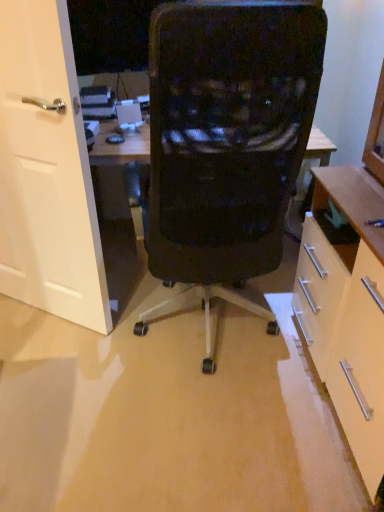
Question: Is white matte door at left wider than black mesh chair at center?

Choices:
 (A) no
 (B) yes

Answer: (A)

Question: Does white matte door at left come behind black mesh chair at center?

Choices:
 (A) yes
 (B) no

Answer: (A)

Question: Is white matte door at left not close to black mesh chair at center?

Choices:
 (A) yes
 (B) no

Answer: (B)

Question: Is white matte door at left positioned with its back to black mesh chair at center?

Choices:
 (A) yes
 (B) no

Answer: (B)

Question: Considering the relative sizes of white matte door at left and black mesh chair at center in the image provided, is white matte door at left thinner than black mesh chair at center?

Choices:
 (A) yes
 (B) no

Answer: (A)

Question: Can black mesh chair at center be found inside white matte door at left?

Choices:
 (A) yes
 (B) no

Answer: (B)

Question: Can you confirm if black mesh chair at center is bigger than white matte door at left?

Choices:
 (A) no
 (B) yes

Answer: (B)

Question: From the image's perspective, would you say black mesh chair at center is shown under white matte door at left?

Choices:
 (A) no
 (B) yes

Answer: (B)

Question: Considering the relative sizes of black mesh chair at center and white matte door at left in the image provided, is black mesh chair at center wider than white matte door at left?

Choices:
 (A) yes
 (B) no

Answer: (A)

Question: Is black mesh chair at center at the left side of white matte door at left?

Choices:
 (A) yes
 (B) no

Answer: (B)

Question: From the image's perspective, is black mesh chair at center on top of white matte door at left?

Choices:
 (A) no
 (B) yes

Answer: (A)

Question: Can you confirm if black mesh chair at center is taller than white matte door at left?

Choices:
 (A) no
 (B) yes

Answer: (B)

Question: Is matte white cabinet at right positioned with its back to white matte door at left?

Choices:
 (A) yes
 (B) no

Answer: (B)